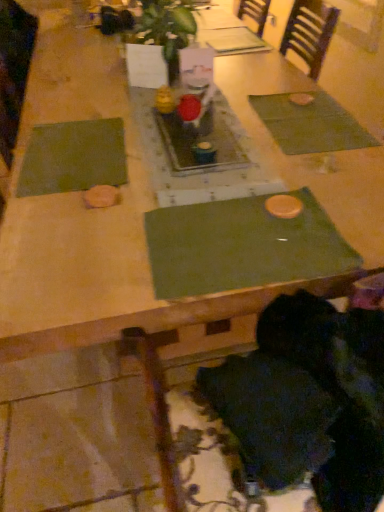
Question: Does point (153, 247) appear closer or farther from the camera than point (292, 117)?

Choices:
 (A) closer
 (B) farther

Answer: (A)

Question: Based on their positions, is green fabric place mat at center, which is counted as the 2th place mat, starting from the right, located to the left or right of green fabric placemat at upper right, the 3th place mat viewed from the left?

Choices:
 (A) right
 (B) left

Answer: (B)

Question: Which is farther from the green fabric place mat at center, which appears as the second place mat when viewed from the left?

Choices:
 (A) green leafy plant at center
 (B) green fabric place mat at left, which is counted as the third place mat, starting from the right
 (C) black fuzzy hair at lower right
 (D) green fabric placemat at upper right, the 3th place mat viewed from the left

Answer: (A)

Question: Which object is the closest to the green fabric place mat at left, which is counted as the third place mat, starting from the right?

Choices:
 (A) green fabric placemat at upper right, which is counted as the first place mat, starting from the right
 (B) green leafy plant at center
 (C) green fabric place mat at center, which is counted as the 2th place mat, starting from the right
 (D) black fuzzy hair at lower right

Answer: (C)